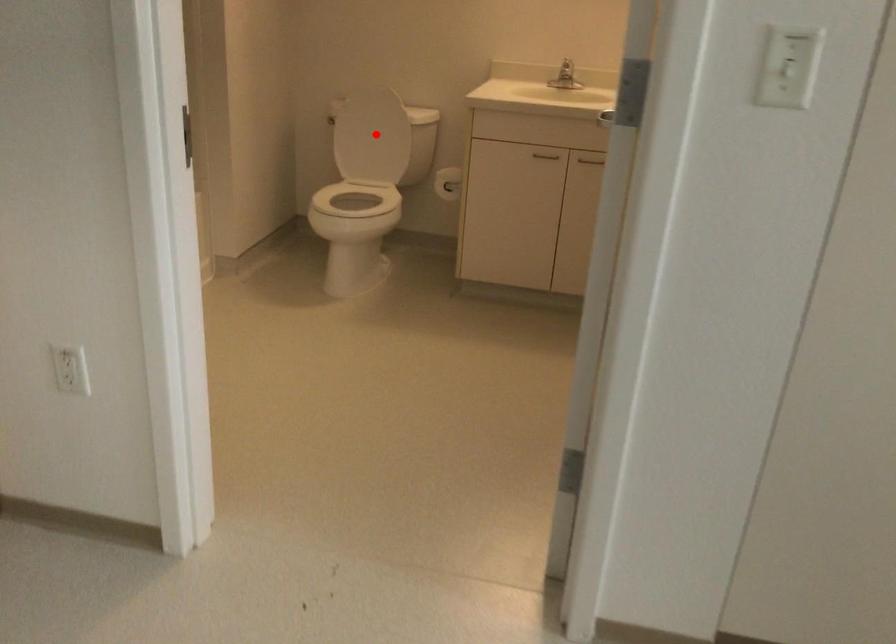
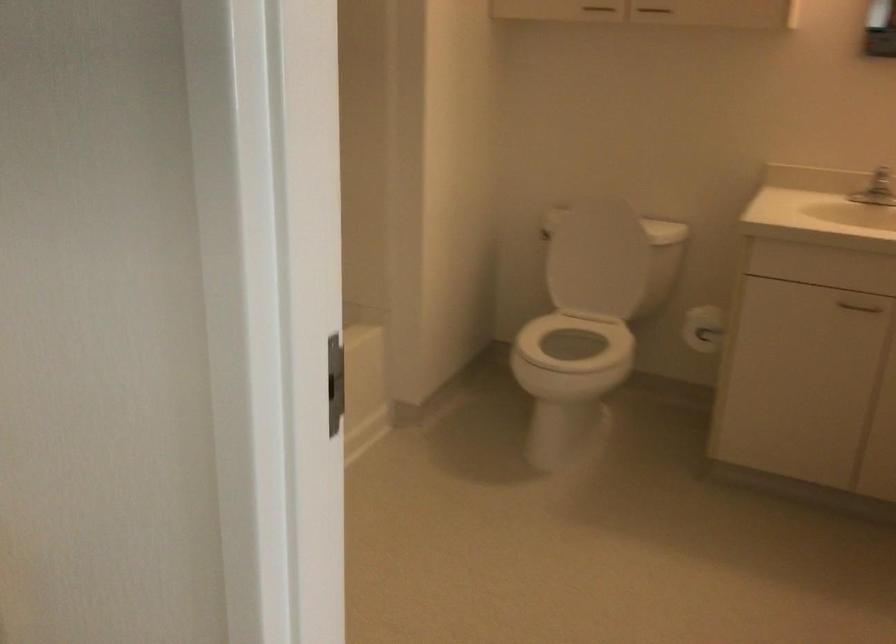
Where in the second image is the point corresponding to the highlighted location from the first image?

(596, 258)